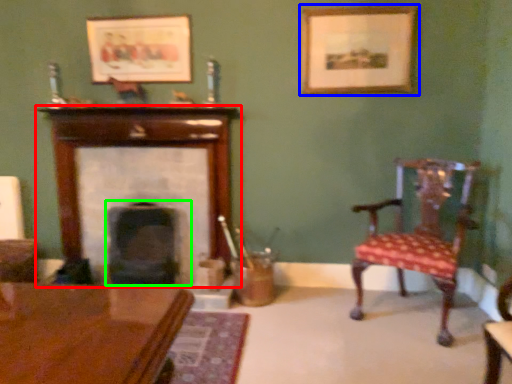
Question: Which is nearer to the fireplace (highlighted by a red box)? picture frame (highlighted by a blue box) or fireplace (highlighted by a green box).

Choices:
 (A) picture frame
 (B) fireplace

Answer: (B)